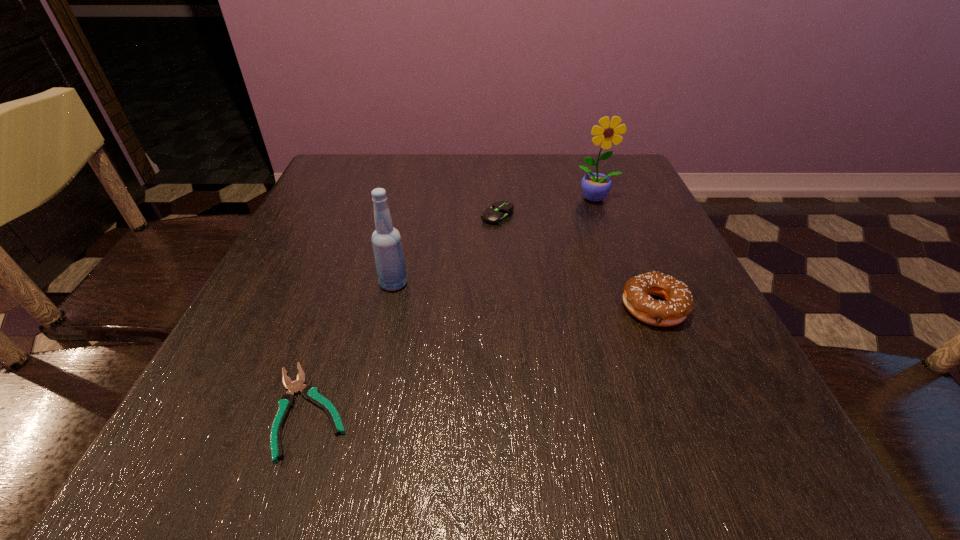
You are a GUI agent. You are given a task and a screenshot of the screen. Output one action in this format:
    pyautogui.click(x=<x>, y=<y>)
    Task: Click on the vacant space situated on the back of the computer mouse
    This screenshot has width=960, height=540.
    Given the screenshot: What is the action you would take?
    (496, 190)

The width and height of the screenshot is (960, 540). What are the coordinates of `free region located 0.220m on the back of the shortest object` in the screenshot? It's located at (355, 272).

Locate an element on the screen. The width and height of the screenshot is (960, 540). object that is at the far edge is located at coordinates (595, 186).

At what (x,y) coordinates should I click in order to perform the action: click on object at the near edge. Please return your answer as a coordinate pair (x, y). Looking at the image, I should click on pyautogui.click(x=310, y=393).

At what (x,y) coordinates should I click in order to perform the action: click on object that is at the left edge. Please return your answer as a coordinate pair (x, y). This screenshot has height=540, width=960. Looking at the image, I should click on (310, 393).

Find the location of a particular element. The image size is (960, 540). sunflower positioned at the right edge is located at coordinates (595, 186).

Where is `doughnut at the right edge`? This screenshot has width=960, height=540. doughnut at the right edge is located at coordinates click(678, 304).

Where is `object at the near left corner`? The width and height of the screenshot is (960, 540). object at the near left corner is located at coordinates (310, 393).

Where is `object that is positioned at the far right corner`? The width and height of the screenshot is (960, 540). object that is positioned at the far right corner is located at coordinates (595, 186).

In the image, there is a desktop. Where is `vacant space at the far edge`? vacant space at the far edge is located at coordinates [538, 157].